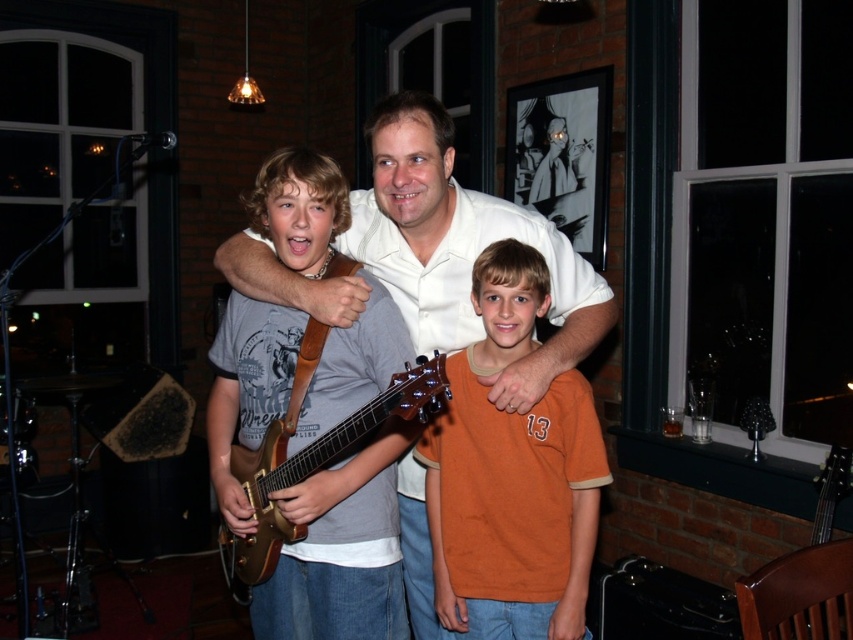
Question: Which point appears farthest from the camera in this image?

Choices:
 (A) (511, 403)
 (B) (405, 396)
 (C) (573, 576)
 (D) (396, 333)

Answer: (D)

Question: Which point is farther to the camera?

Choices:
 (A) wooden electric guitar at center
 (B) gold metallic guitar at center
 (C) white smooth shirt at center

Answer: (A)

Question: Can you confirm if wooden electric guitar at center is smaller than white smooth shirt at center?

Choices:
 (A) no
 (B) yes

Answer: (B)

Question: From the image, what is the correct spatial relationship of wooden electric guitar at center in relation to gold metallic guitar at center?

Choices:
 (A) left
 (B) right

Answer: (A)

Question: Does wooden electric guitar at center appear on the right side of white smooth shirt at center?

Choices:
 (A) yes
 (B) no

Answer: (B)

Question: Which object appears farthest from the camera in this image?

Choices:
 (A) gold metallic guitar at center
 (B) wooden electric guitar at center
 (C) white smooth shirt at center
 (D) orange cotton shirt at center

Answer: (B)